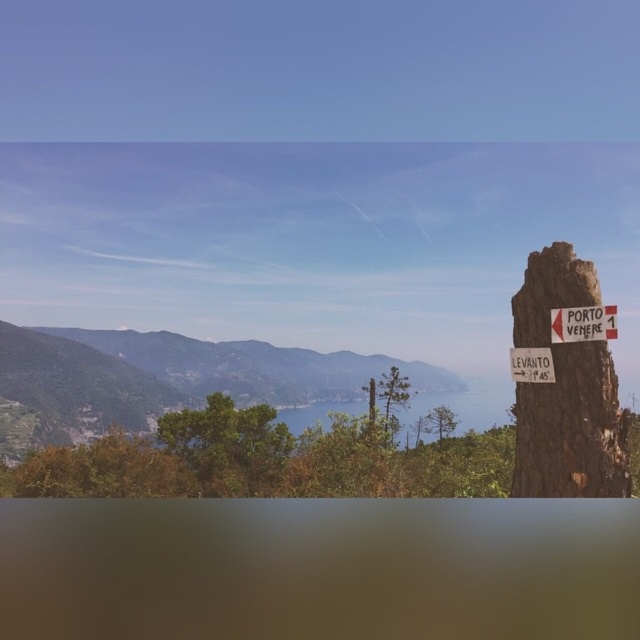
You are a hiker trying to decide which path to take. You see a green leafy mountain at left and a brown wooden signpost at right. Which object is wider from your perspective?

The green leafy mountain at left might be wider than brown wooden signpost at right.

You are a hiker standing at the tree stump and want to read both the white plastic sign at right and the brown wooden signpost at right. Which one can you see more clearly?

The white plastic sign at right is closer to the viewer than the brown wooden signpost at right, so you can see the white plastic sign at right more clearly.